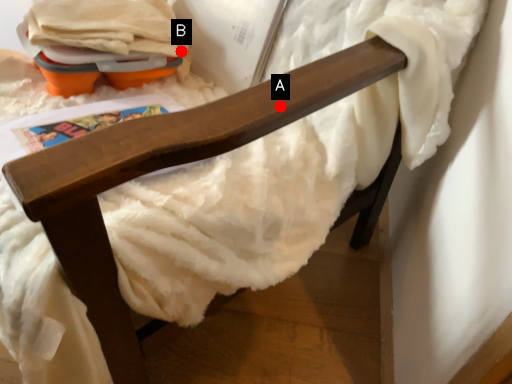
Question: Two points are circled on the image, labeled by A and B beside each circle. Which point is farther to the camera?

Choices:
 (A) A is further
 (B) B is further

Answer: (B)